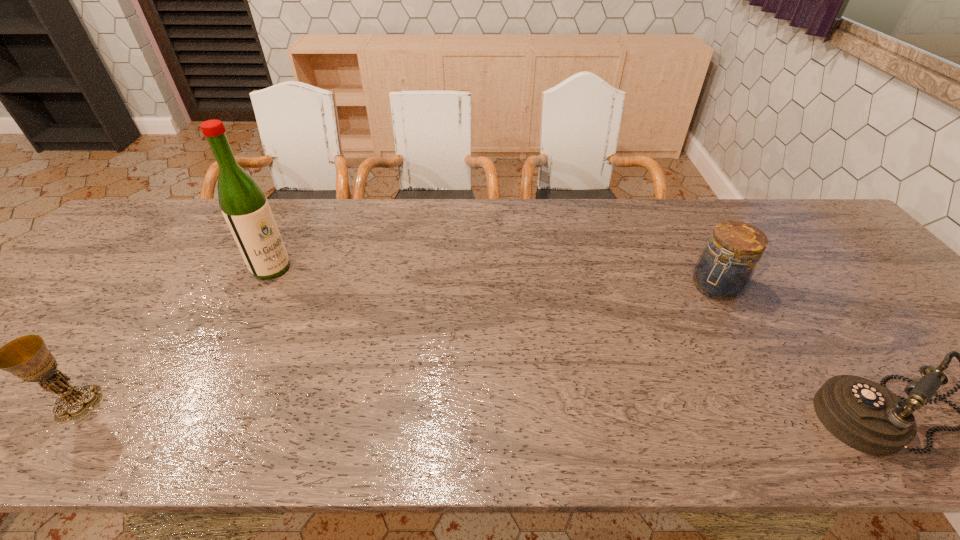
Locate an element on the screen. The image size is (960, 540). object identified as the second closest to the telephone is located at coordinates (244, 206).